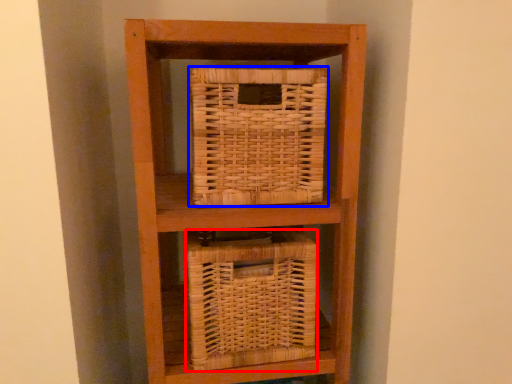
Question: Which point is closer to the camera, basket (highlighted by a red box) or basket (highlighted by a blue box)?

Choices:
 (A) basket
 (B) basket

Answer: (B)